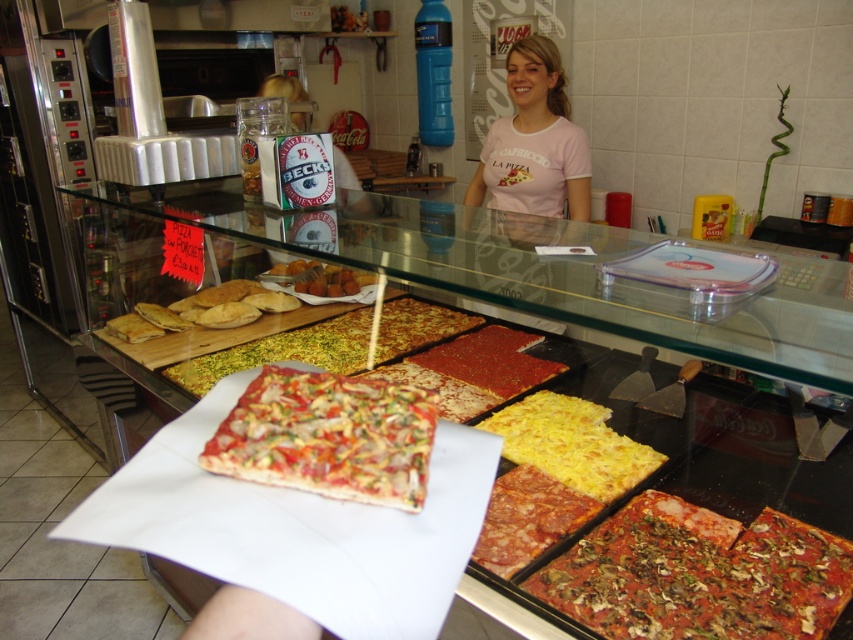
Is reddish-brown crispy pizza at lower right bigger than red pepperoni pizza at center?

Correct, reddish-brown crispy pizza at lower right is larger in size than red pepperoni pizza at center.

Is reddish-brown crispy pizza at lower right wider than red pepperoni pizza at center?

Yes.

Locate an element on the screen. The image size is (853, 640). reddish-brown crispy pizza at lower right is located at coordinates (699, 573).

Is reddish-brown crispy pizza at lower right shorter than crustless pizza with colorful toppings at center?

Incorrect, reddish-brown crispy pizza at lower right's height does not fall short of crustless pizza with colorful toppings at center's.

Is reddish-brown crispy pizza at lower right behind crustless pizza with colorful toppings at center?

Yes, it is.

You are a GUI agent. You are given a task and a screenshot of the screen. Output one action in this format:
    pyautogui.click(x=<x>, y=<y>)
    Task: Click on the reddish-brown crispy pizza at lower right
    The width and height of the screenshot is (853, 640).
    Given the screenshot: What is the action you would take?
    pyautogui.click(x=699, y=573)

Does yellow cheese pizza at center come behind golden crispy pizza at center?

No, yellow cheese pizza at center is in front of golden crispy pizza at center.

Is yellow cheese pizza at center to the right of golden crispy pizza at center from the viewer's perspective?

Indeed, yellow cheese pizza at center is positioned on the right side of golden crispy pizza at center.

Is point (610, 500) behind point (308, 292)?

No, (610, 500) is in front of (308, 292).

Locate an element on the screen. This screenshot has width=853, height=640. yellow cheese pizza at center is located at coordinates (572, 444).